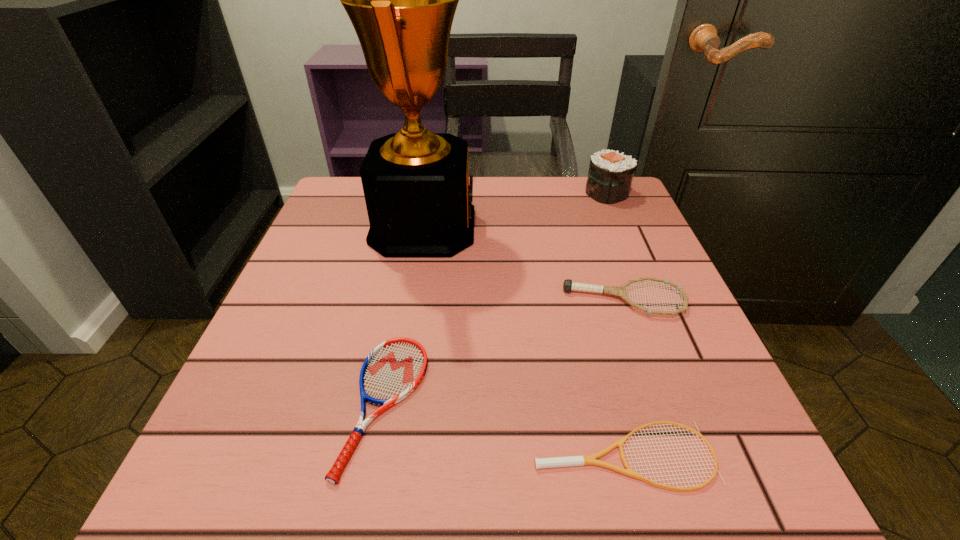
Where is `object that stands as the second closest to the tallest object`? Image resolution: width=960 pixels, height=540 pixels. object that stands as the second closest to the tallest object is located at coordinates (568, 286).

Find the location of a particular element. the third closest tennis racket to the second tallest object is located at coordinates (583, 460).

Locate which tennis racket ranks in proximity to the trophy cup. Please provide its 2D coordinates. Your answer should be formatted as a tuple, i.e. [(x, y)], where the tuple contains the x and y coordinates of a point satisfying the conditions above.

[(393, 370)]

Where is `free space in the image that satisfies the following two spatial constraints: 1. on the front of the trophy cup with the label; 2. on the back side of the tallest tennis racket`? This screenshot has width=960, height=540. free space in the image that satisfies the following two spatial constraints: 1. on the front of the trophy cup with the label; 2. on the back side of the tallest tennis racket is located at coordinates click(x=411, y=300).

This screenshot has height=540, width=960. Identify the location of free spot that satisfies the following two spatial constraints: 1. on the back side of the third tallest object; 2. on the left side of the leftmost tennis racket. (404, 300).